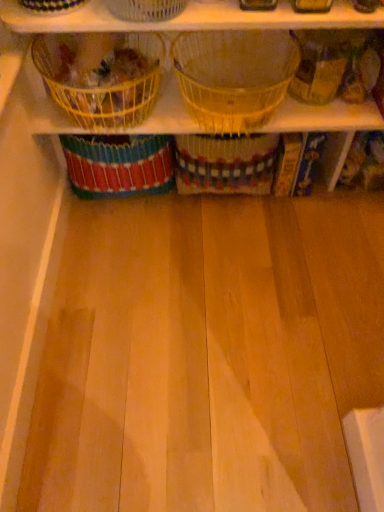
Question: Is yellow wire basket at upper left, which appears as the first basket when viewed from the left, positioned with its back to clear plastic basket at upper center, acting as the second basket starting from the left?

Choices:
 (A) yes
 (B) no

Answer: (B)

Question: Would you consider yellow wire basket at upper left, which appears as the first basket when viewed from the left, to be distant from clear plastic basket at upper center, the 2th basket when ordered from right to left?

Choices:
 (A) yes
 (B) no

Answer: (B)

Question: From the image's perspective, is yellow wire basket at upper left, positioned as the third basket in right-to-left order, below clear plastic basket at upper center, acting as the second basket starting from the left?

Choices:
 (A) yes
 (B) no

Answer: (A)

Question: From a real-world perspective, does yellow wire basket at upper left, positioned as the third basket in right-to-left order, stand above clear plastic basket at upper center, the 2th basket when ordered from right to left?

Choices:
 (A) no
 (B) yes

Answer: (A)

Question: Is yellow wire basket at upper left, which appears as the first basket when viewed from the left, not inside clear plastic basket at upper center, acting as the second basket starting from the left?

Choices:
 (A) yes
 (B) no

Answer: (A)

Question: From the image's perspective, is yellow wire basket at upper left, which appears as the first basket when viewed from the left, on top of clear plastic basket at upper center, acting as the second basket starting from the left?

Choices:
 (A) no
 (B) yes

Answer: (A)

Question: Could you tell me if clear plastic basket at upper center, acting as the second basket starting from the left, is facing yellow wire basket at upper left, which appears as the first basket when viewed from the left?

Choices:
 (A) yes
 (B) no

Answer: (B)

Question: From a real-world perspective, is clear plastic basket at upper center, the 2th basket when ordered from right to left, located beneath yellow wire basket at upper left, positioned as the third basket in right-to-left order?

Choices:
 (A) no
 (B) yes

Answer: (A)

Question: From a real-world perspective, does clear plastic basket at upper center, acting as the second basket starting from the left, stand above yellow wire basket at upper left, which appears as the first basket when viewed from the left?

Choices:
 (A) yes
 (B) no

Answer: (A)

Question: Is clear plastic basket at upper center, the 2th basket when ordered from right to left, at the left side of yellow wire basket at upper left, which appears as the first basket when viewed from the left?

Choices:
 (A) yes
 (B) no

Answer: (B)

Question: Is clear plastic basket at upper center, the 2th basket when ordered from right to left, positioned in front of yellow wire basket at upper left, positioned as the third basket in right-to-left order?

Choices:
 (A) no
 (B) yes

Answer: (B)

Question: Is clear plastic basket at upper center, the 2th basket when ordered from right to left, looking in the opposite direction of yellow wire basket at upper left, positioned as the third basket in right-to-left order?

Choices:
 (A) yes
 (B) no

Answer: (B)

Question: Is the position of yellow wire basket at upper left, positioned as the third basket in right-to-left order, more distant than that of translucent plastic basket at center, the first basket positioned from the right?

Choices:
 (A) no
 (B) yes

Answer: (B)